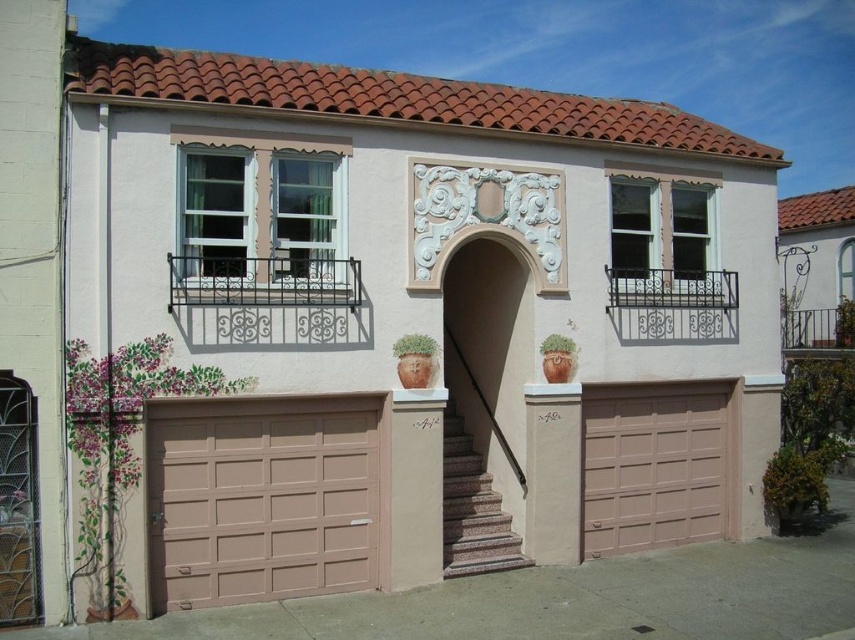
Question: Which of the following is the closest to the observer?

Choices:
 (A) granite stairs at center
 (B) tan matte garage door at lower left

Answer: (B)

Question: Which point is closer to the camera?

Choices:
 (A) granite stairs at center
 (B) beige textured garage door at center
 (C) tan matte garage door at lower left

Answer: (C)

Question: Does tan matte garage door at lower left appear under beige textured garage door at center?

Choices:
 (A) no
 (B) yes

Answer: (A)

Question: Can you confirm if beige textured garage door at center is positioned above granite stairs at center?

Choices:
 (A) yes
 (B) no

Answer: (A)

Question: Observing the image, what is the correct spatial positioning of beige textured garage door at center in reference to granite stairs at center?

Choices:
 (A) below
 (B) above

Answer: (B)

Question: Which point appears farthest from the camera in this image?

Choices:
 (A) (269, 536)
 (B) (476, 499)
 (C) (694, 465)

Answer: (C)